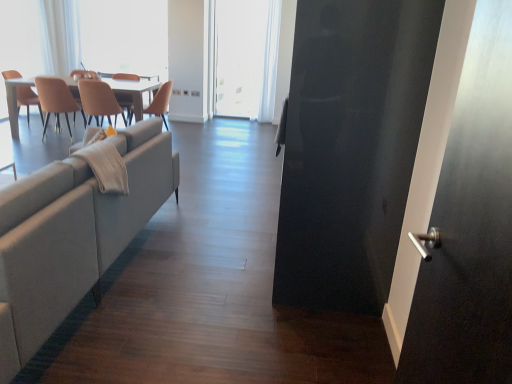
What do you see at coordinates (270, 62) in the screenshot? This screenshot has width=512, height=384. I see `white sheer curtain at upper center` at bounding box center [270, 62].

Measure the distance between matte orange chair at left, the fourth chair in the right-to-left sequence, and camera.

The depth of matte orange chair at left, the fourth chair in the right-to-left sequence, is 3.91 meters.

Where is `matte beige chair at left, marked as the 3th chair in a right-to-left arrangement`? This screenshot has width=512, height=384. matte beige chair at left, marked as the 3th chair in a right-to-left arrangement is located at coordinates (57, 101).

The height and width of the screenshot is (384, 512). I want to click on white sheer curtain at upper center, so click(x=270, y=62).

How distant is white matte window screen at center, arranged as the 2th window screen when viewed from the left, from beige leather chair at center, placed as the 1th chair when sorted from right to left?

white matte window screen at center, arranged as the 2th window screen when viewed from the left, and beige leather chair at center, placed as the 1th chair when sorted from right to left, are 2.84 meters apart.

Does white matte window screen at center, which is counted as the first window screen, starting from the right, have a greater height compared to beige leather chair at center, which is the fourth chair from left to right?

Correct, white matte window screen at center, which is counted as the first window screen, starting from the right, is much taller as beige leather chair at center, which is the fourth chair from left to right.

In terms of size, does white matte window screen at center, arranged as the 2th window screen when viewed from the left, appear bigger or smaller than beige leather chair at center, which is the fourth chair from left to right?

white matte window screen at center, arranged as the 2th window screen when viewed from the left, is bigger than beige leather chair at center, which is the fourth chair from left to right.

Is white matte window screen at center, arranged as the 2th window screen when viewed from the left, aimed at beige leather chair at center, which is the fourth chair from left to right?

No.

At what (x,y) coordinates should I click in order to perform the action: click on kitchen & dining room table behind the matte beige chair at left, marked as the 3th chair in a right-to-left arrangement. Please return your answer as a coordinate pair (x, y). This screenshot has height=384, width=512. Looking at the image, I should click on (133, 92).

Is white glossy table at upper left touching matte beige chair at left, placed as the 2th chair when sorted from left to right?

No, white glossy table at upper left is not next to matte beige chair at left, placed as the 2th chair when sorted from left to right.

From a real-world perspective, who is located lower, white glossy table at upper left or matte beige chair at left, placed as the 2th chair when sorted from left to right?

white glossy table at upper left is physically lower.

Considering the positions of objects white glossy table at upper left and matte beige chair at left, placed as the 2th chair when sorted from left to right, in the image provided, who is behind, white glossy table at upper left or matte beige chair at left, placed as the 2th chair when sorted from left to right,?

white glossy table at upper left is further from the camera.

The height and width of the screenshot is (384, 512). Find the location of `screen door on the right of white matte window screen at center, which is counted as the first window screen, starting from the right`. screen door on the right of white matte window screen at center, which is counted as the first window screen, starting from the right is located at coordinates (351, 148).

Between white matte window screen at center, arranged as the 2th window screen when viewed from the left, and glossy black screen door at right, which one appears on the left side from the viewer's perspective?

white matte window screen at center, arranged as the 2th window screen when viewed from the left, is more to the left.

Could you tell me if white matte window screen at center, which is counted as the first window screen, starting from the right, is turned towards glossy black screen door at right?

Yes.

Considering the sizes of objects white matte window screen at center, arranged as the 2th window screen when viewed from the left, and glossy black screen door at right in the image provided, who is taller, white matte window screen at center, arranged as the 2th window screen when viewed from the left, or glossy black screen door at right?

white matte window screen at center, arranged as the 2th window screen when viewed from the left.

Consider the image. Considering the positions of objects matte orange chair at left, which appears as the 1th chair when viewed from the left, and matte beige chair at left, marked as the 3th chair in a right-to-left arrangement, in the image provided, who is more to the left, matte orange chair at left, which appears as the 1th chair when viewed from the left, or matte beige chair at left, marked as the 3th chair in a right-to-left arrangement,?

Positioned to the left is matte orange chair at left, which appears as the 1th chair when viewed from the left.

Is matte orange chair at left, which appears as the 1th chair when viewed from the left, facing towards matte beige chair at left, marked as the 3th chair in a right-to-left arrangement?

Yes.

In the scene shown: From the image's perspective, is matte orange chair at left, which appears as the 1th chair when viewed from the left, on top of matte beige chair at left, marked as the 3th chair in a right-to-left arrangement?

Correct, matte orange chair at left, which appears as the 1th chair when viewed from the left, appears higher than matte beige chair at left, marked as the 3th chair in a right-to-left arrangement, in the image.

Does point (4, 79) come behind point (47, 90)?

No, it is in front of (47, 90).

Considering the sizes of white glossy table at upper left and transparent plastic window screen at upper left, the second window screen positioned from the right, in the image, is white glossy table at upper left taller or shorter than transparent plastic window screen at upper left, the second window screen positioned from the right,?

Clearly, white glossy table at upper left is shorter compared to transparent plastic window screen at upper left, the second window screen positioned from the right.

Locate an element on the screen. The width and height of the screenshot is (512, 384). window screen that is the 2nd one when counting backward from the white glossy table at upper left is located at coordinates (125, 37).

How much distance is there between white glossy table at upper left and transparent plastic window screen at upper left, the 1th window screen from the left?

They are 28.43 inches apart.

In terms of width, does white glossy table at upper left look wider or thinner when compared to transparent plastic window screen at upper left, the second window screen positioned from the right?

In the image, white glossy table at upper left appears to be wider than transparent plastic window screen at upper left, the second window screen positioned from the right.

Which of these two, transparent plastic window screen at upper left, the second window screen positioned from the right, or beige leather chair at center, placed as the 1th chair when sorted from right to left, is bigger?

Bigger between the two is transparent plastic window screen at upper left, the second window screen positioned from the right.

Considering the sizes of objects transparent plastic window screen at upper left, the 1th window screen from the left, and beige leather chair at center, which is the fourth chair from left to right, in the image provided, who is wider, transparent plastic window screen at upper left, the 1th window screen from the left, or beige leather chair at center, which is the fourth chair from left to right,?

With larger width is beige leather chair at center, which is the fourth chair from left to right.

Considering the positions of objects transparent plastic window screen at upper left, the second window screen positioned from the right, and beige leather chair at center, which is the fourth chair from left to right, in the image provided, who is in front, transparent plastic window screen at upper left, the second window screen positioned from the right, or beige leather chair at center, which is the fourth chair from left to right,?

beige leather chair at center, which is the fourth chair from left to right, is more forward.

From the image's perspective, does light gray fabric couch at left appear lower than transparent plastic window screen at upper left, the 1th window screen from the left?

Indeed, from the image's perspective, light gray fabric couch at left is shown beneath transparent plastic window screen at upper left, the 1th window screen from the left.

Is light gray fabric couch at left looking in the opposite direction of transparent plastic window screen at upper left, the 1th window screen from the left?

That's not correct — light gray fabric couch at left is not looking away from transparent plastic window screen at upper left, the 1th window screen from the left.

From a real-world perspective, which is physically below, light gray fabric couch at left or transparent plastic window screen at upper left, the second window screen positioned from the right?

light gray fabric couch at left, from a real-world perspective.

Can you confirm if light gray fabric couch at left is thinner than transparent plastic window screen at upper left, the second window screen positioned from the right?

Incorrect, the width of light gray fabric couch at left is not less than that of transparent plastic window screen at upper left, the second window screen positioned from the right.

At what (x,y) coordinates should I click in order to perform the action: click on the 2nd chair in front of the white matte window screen at center, arranged as the 2th window screen when viewed from the left. Please return your answer as a coordinate pair (x, y). This screenshot has height=384, width=512. Looking at the image, I should click on pos(160,102).

Find the location of a particular element. Image resolution: width=512 pixels, height=384 pixels. kitchen & dining room table located on the right of matte beige chair at left, placed as the 2th chair when sorted from left to right is located at coordinates (133, 92).

Considering their positions, is white glossy table at upper left positioned closer to matte beige chair at center, placed as the 2th chair when sorted from right to left, than glossy black screen door at right?

white glossy table at upper left.

When comparing their distances from matte orange chair at left, which appears as the 1th chair when viewed from the left, does white matte window screen at center, arranged as the 2th window screen when viewed from the left, or transparent plastic window screen at upper left, the second window screen positioned from the right, seem further?

white matte window screen at center, arranged as the 2th window screen when viewed from the left, is positioned further to the anchor matte orange chair at left, which appears as the 1th chair when viewed from the left.

When comparing their distances from white glossy table at upper left, does white matte window screen at center, arranged as the 2th window screen when viewed from the left, or matte beige chair at left, placed as the 2th chair when sorted from left to right, seem further?

The object further to white glossy table at upper left is white matte window screen at center, arranged as the 2th window screen when viewed from the left.

Estimate the real-world distances between objects in this image. Which object is further from transparent plastic window screen at upper left, the second window screen positioned from the right, matte beige chair at center, which is the 3th chair from left to right, or beige leather chair at center, which is the fourth chair from left to right?

beige leather chair at center, which is the fourth chair from left to right, is further to transparent plastic window screen at upper left, the second window screen positioned from the right.

Based on their spatial positions, is beige leather chair at center, which is the fourth chair from left to right, or white sheer curtain at upper center further from matte beige chair at center, placed as the 2th chair when sorted from right to left?

Among the two, white sheer curtain at upper center is located further to matte beige chair at center, placed as the 2th chair when sorted from right to left.

Based on their spatial positions, is matte beige chair at center, placed as the 2th chair when sorted from right to left, or light gray fabric couch at left further from white glossy table at upper left?

light gray fabric couch at left lies further to white glossy table at upper left than the other object.

Looking at the image, which one is located closer to matte beige chair at left, placed as the 2th chair when sorted from left to right, light gray fabric couch at left or white matte window screen at center, which is counted as the first window screen, starting from the right?

light gray fabric couch at left is positioned closer to the anchor matte beige chair at left, placed as the 2th chair when sorted from left to right.

Based on the photo, which object lies nearer to the anchor point light gray fabric couch at left, white matte window screen at center, arranged as the 2th window screen when viewed from the left, or beige leather chair at center, which is the fourth chair from left to right?

beige leather chair at center, which is the fourth chair from left to right, is closer to light gray fabric couch at left.

Identify the location of chair between matte beige chair at center, which is the 3th chair from left to right, and white sheer curtain at upper center. Image resolution: width=512 pixels, height=384 pixels. (160, 102).

Where is `chair positioned between beige leather chair at center, which is the fourth chair from left to right, and transparent plastic window screen at upper left, the second window screen positioned from the right, from near to far`? The width and height of the screenshot is (512, 384). chair positioned between beige leather chair at center, which is the fourth chair from left to right, and transparent plastic window screen at upper left, the second window screen positioned from the right, from near to far is located at coordinates (28, 101).

Where is `kitchen & dining room table between matte beige chair at left, placed as the 2th chair when sorted from left to right, and beige leather chair at center, which is the fourth chair from left to right`? kitchen & dining room table between matte beige chair at left, placed as the 2th chair when sorted from left to right, and beige leather chair at center, which is the fourth chair from left to right is located at coordinates (133, 92).

Where is `chair between light gray fabric couch at left and matte beige chair at left, placed as the 2th chair when sorted from left to right, from front to back`? The width and height of the screenshot is (512, 384). chair between light gray fabric couch at left and matte beige chair at left, placed as the 2th chair when sorted from left to right, from front to back is located at coordinates (99, 101).